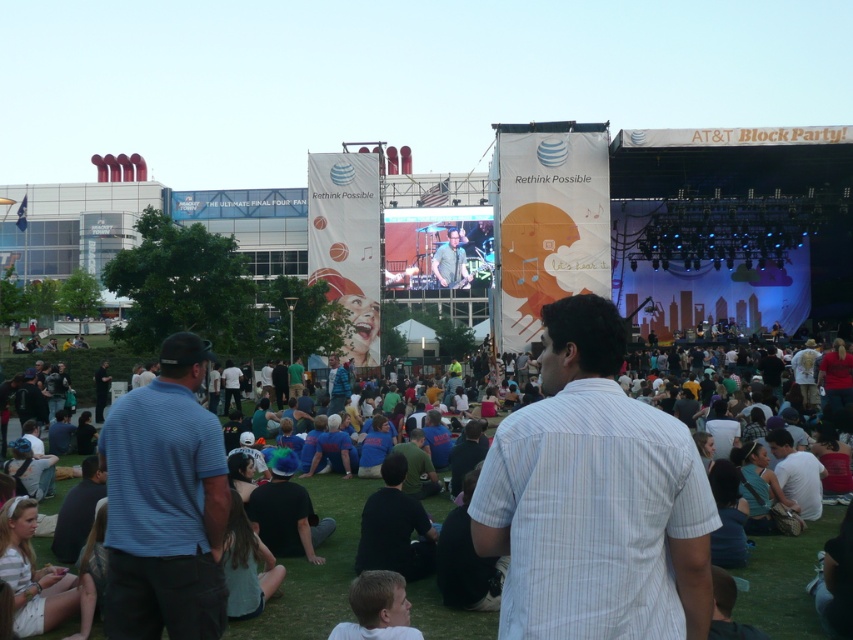
Question: Estimate the real-world distances between objects in this image. Which object is closer to the white striped shirt at center?

Choices:
 (A) dark gray shirt at center
 (B) light blue striped shirt at lower right

Answer: (A)

Question: Does dark gray shirt at center have a greater width compared to green fabric shirt at center?

Choices:
 (A) no
 (B) yes

Answer: (A)

Question: Which of the following is the closest to the observer?

Choices:
 (A) light brown hair at lower center
 (B) blue striped polo shirt at center
 (C) dark blue shirt at center
 (D) light blue striped shirt at lower right

Answer: (B)

Question: Is dark gray shirt at center positioned in front of dark green t-shirt at center?

Choices:
 (A) yes
 (B) no

Answer: (A)

Question: Which point is farther from the camera taking this photo?

Choices:
 (A) (787, 483)
 (B) (440, 248)
 (C) (155, 385)

Answer: (B)

Question: Does blue striped polo shirt at center appear on the left side of blue denim jeans at center?

Choices:
 (A) no
 (B) yes

Answer: (B)